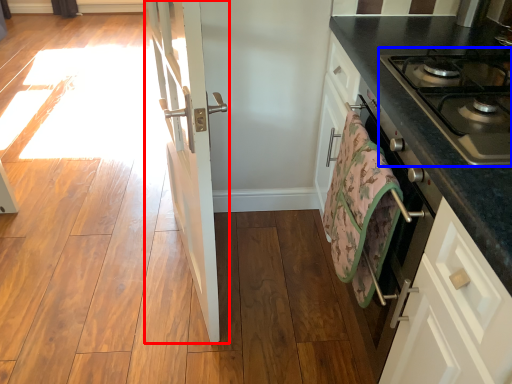
Question: Which point is further to the camera, door (highlighted by a red box) or gas stove (highlighted by a blue box)?

Choices:
 (A) door
 (B) gas stove

Answer: (A)